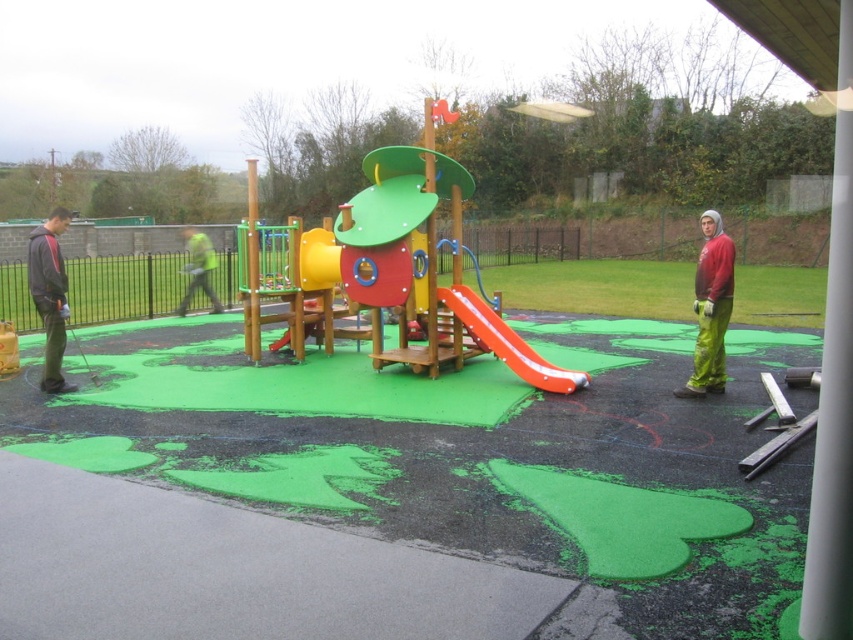
Question: Estimate the real-world distances between objects in this image. Which object is farther from the dark gray hoodie at left?

Choices:
 (A) green fabric jacket at center
 (B) rubber smooth slide at center

Answer: (A)

Question: Estimate the real-world distances between objects in this image. Which object is closer to the dark gray hoodie at left?

Choices:
 (A) green fabric jacket at center
 (B) red matte jacket at right
 (C) rubber smooth slide at center

Answer: (C)

Question: Can you confirm if red matte jacket at right is positioned below dark gray hoodie at left?

Choices:
 (A) yes
 (B) no

Answer: (B)

Question: Does rubber smooth slide at center have a greater width compared to green fabric jacket at center?

Choices:
 (A) yes
 (B) no

Answer: (B)

Question: Which is nearer to the rubber smooth slide at center?

Choices:
 (A) red matte jacket at right
 (B) green fabric jacket at center

Answer: (A)

Question: Does dark gray hoodie at left come in front of rubber smooth slide at center?

Choices:
 (A) yes
 (B) no

Answer: (A)